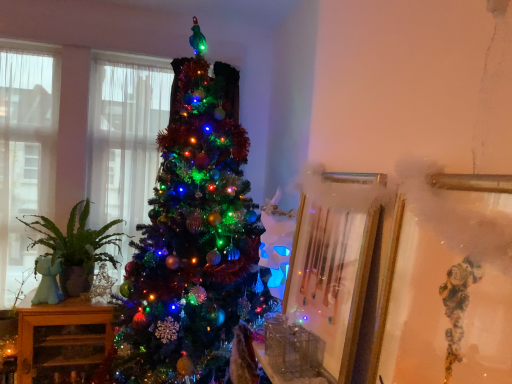
Question: Is gold metallic picture frame at center-right, the 2th picture frame when ordered from front to back, taller or shorter than translucent fabric window at left, the 1th window positioned from the right?

Choices:
 (A) short
 (B) tall

Answer: (A)

Question: Is gold metallic picture frame at center-right, which is the 1th picture frame from back to front, spatially inside translucent fabric window at left, the 1th window positioned from the right, or outside of it?

Choices:
 (A) inside
 (B) outside

Answer: (B)

Question: Which object is the farthest from the gold metallic picture frame at right, which ranks as the 2th picture frame in back-to-front order?

Choices:
 (A) shiny green tinsel at center
 (B) green matte plant at left
 (C) wooden cabinet at left
 (D) clear glass window at left, the 1th window in the left-to-right sequence
 (E) translucent fabric window at left, marked as the 2th window in a left-to-right arrangement

Answer: (D)

Question: Which object is the closest to the green matte plant at left?

Choices:
 (A) clear glass window at left, the 1th window in the left-to-right sequence
 (B) gold metallic picture frame at right, the 1th picture frame in the front-to-back sequence
 (C) translucent fabric window at left, marked as the 2th window in a left-to-right arrangement
 (D) gold metallic picture frame at center-right, which is the 1th picture frame from back to front
 (E) shiny green tinsel at center

Answer: (C)